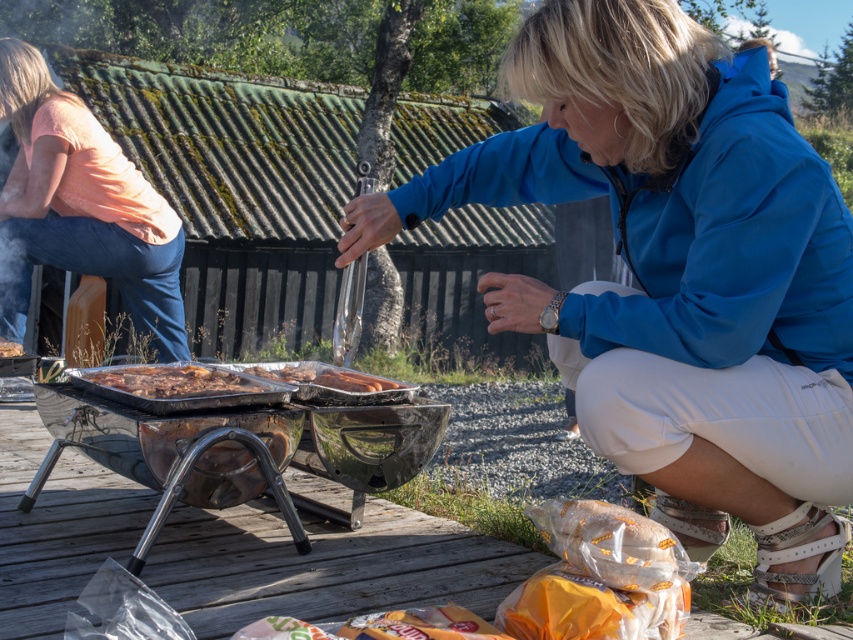
Is shiny metallic tray at center above slightly charred aluminum foil at center?

Incorrect, shiny metallic tray at center is not positioned above slightly charred aluminum foil at center.

Who is positioned more to the right, shiny metallic tray at center or slightly charred aluminum foil at center?

Positioned to the right is slightly charred aluminum foil at center.

Between point (213, 376) and point (355, 381), which one is positioned in front?

Point (213, 376) is more forward.

Identify the location of shiny metallic tray at center. The height and width of the screenshot is (640, 853). (177, 380).

Is matte peach shirt at upper left wider than golden brown meat at center?

Yes, matte peach shirt at upper left is wider than golden brown meat at center.

Is point (22, 132) positioned before point (0, 348)?

No.

Locate an element on the screen. This screenshot has height=640, width=853. matte peach shirt at upper left is located at coordinates [x=82, y=205].

Can you confirm if blue fabric jacket at center is positioned below matte peach shirt at upper left?

Yes, blue fabric jacket at center is below matte peach shirt at upper left.

From the picture: Can you confirm if blue fabric jacket at center is thinner than matte peach shirt at upper left?

In fact, blue fabric jacket at center might be wider than matte peach shirt at upper left.

Does point (605, 189) come in front of point (19, 307)?

Yes, it is.

Where is `blue fabric jacket at center`? The image size is (853, 640). blue fabric jacket at center is located at coordinates point(677,275).